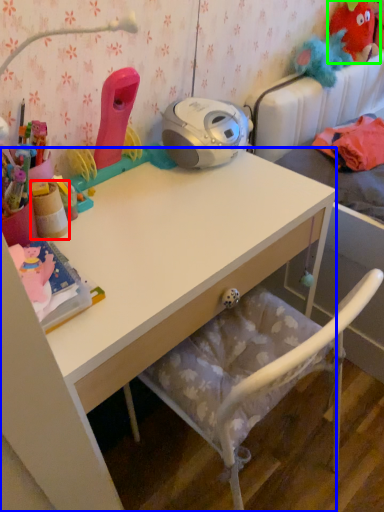
Question: Which object is positioned closest to stationery (highlighted by a red box)? Select from desk (highlighted by a blue box) and toy (highlighted by a green box).

Choices:
 (A) desk
 (B) toy

Answer: (A)